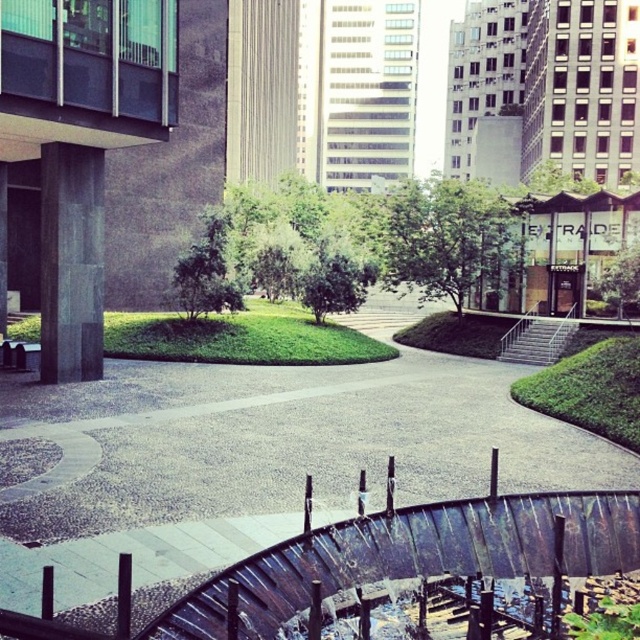
Question: Does gravel pathway at center appear under green leafy tree at center?

Choices:
 (A) yes
 (B) no

Answer: (A)

Question: Observing the image, what is the correct spatial positioning of gravel pathway at center in reference to green leafy tree at center?

Choices:
 (A) right
 (B) left

Answer: (B)

Question: Does gravel pathway at center appear over green leafy tree at center?

Choices:
 (A) yes
 (B) no

Answer: (B)